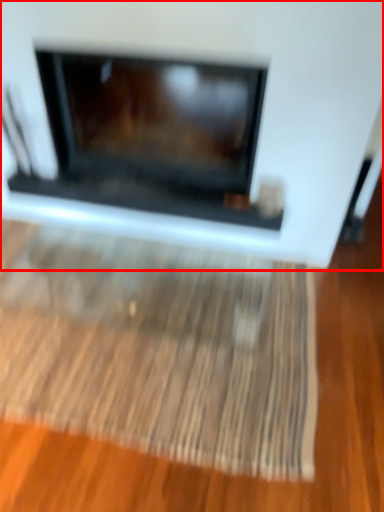
Question: From the image's perspective, considering the relative positions of fireplace (annotated by the red box) and mat in the image provided, where is fireplace (annotated by the red box) located with respect to the staircase?

Choices:
 (A) above
 (B) below

Answer: (A)